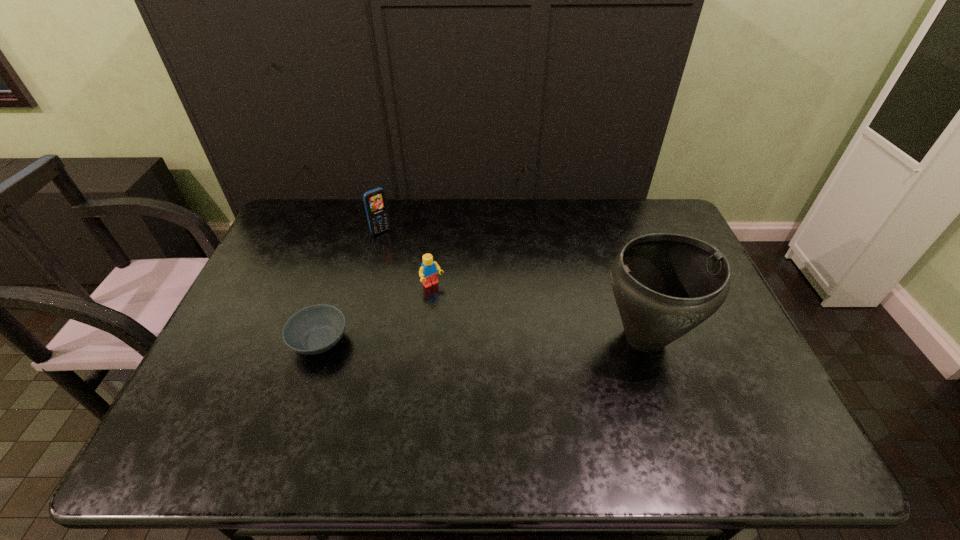
Identify the location of vacant space on the desktop that is between the soup bowl and the tallest object and is positioned on the screen of the cellular telephone. This screenshot has height=540, width=960. (480, 339).

This screenshot has width=960, height=540. In order to click on free spot on the desktop that is between the soup bowl and the rightmost object and is positioned on the front-facing side of the third nearest object in this screenshot , I will do (x=477, y=339).